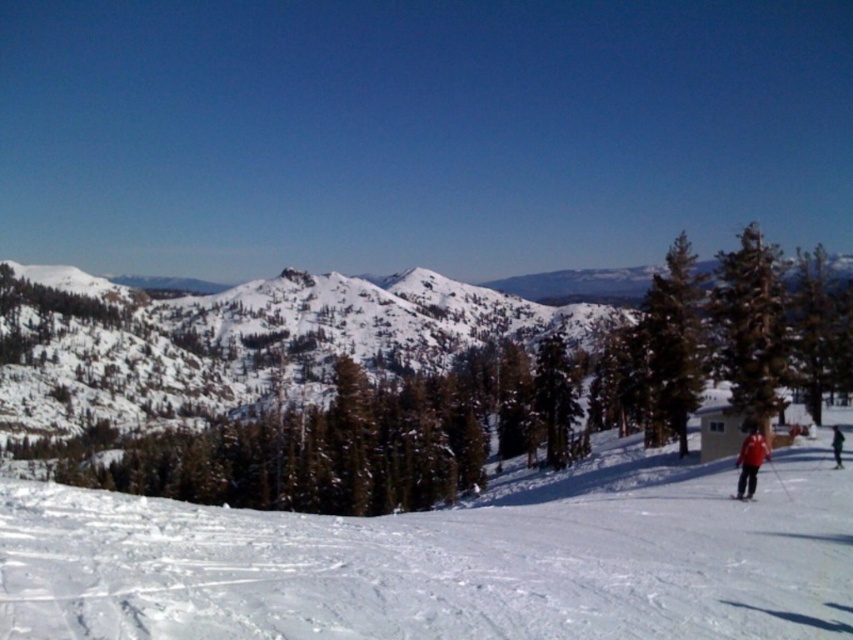
Question: Can you confirm if white powdery snow at lower center is smaller than green textured pine tree at right?

Choices:
 (A) no
 (B) yes

Answer: (B)

Question: Among these points, which one is farthest from the camera?

Choices:
 (A) (599, 403)
 (B) (744, 227)

Answer: (B)

Question: Which object is the farthest from the red matte skier at lower right?

Choices:
 (A) white powdery snow at lower center
 (B) black matte ski at lower right

Answer: (A)

Question: Does red matte skier at lower right lie behind black matte ski at lower right?

Choices:
 (A) no
 (B) yes

Answer: (B)

Question: Based on their relative distances, which object is farther from the dark blue jacket at lower right?

Choices:
 (A) white powdery snow at lower center
 (B) black matte ski at lower right

Answer: (A)

Question: Is green textured pine tree at right positioned behind black matte ski at lower right?

Choices:
 (A) no
 (B) yes

Answer: (B)